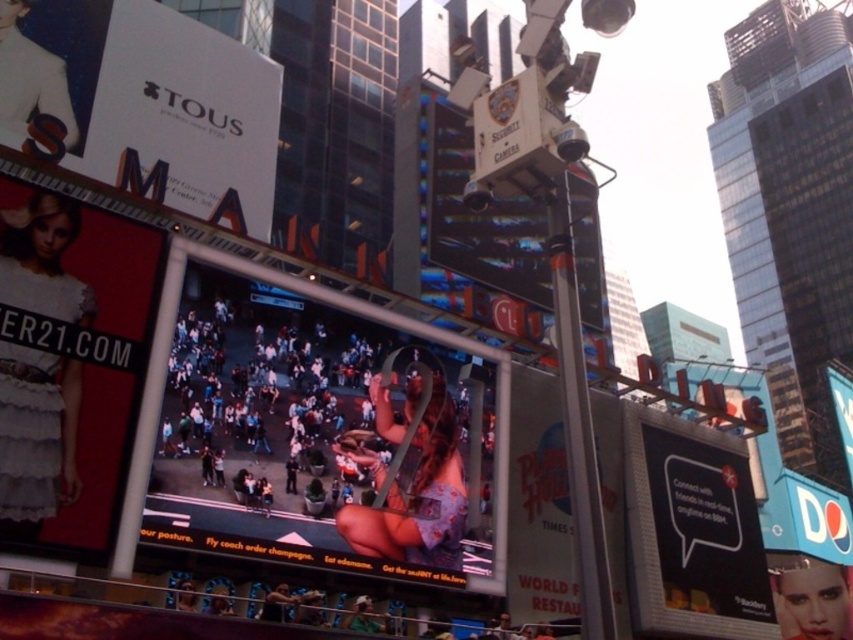
You are standing on a balcony overlooking a city street and see the matte plastic crowd at center and the white glossy signboard at center. Which object is nearer to you?

The matte plastic crowd at center is closer to the viewer than the white glossy signboard at center.

You are standing on a balcony overlooking the city and see two points in the scene. The first point is at coordinate point (161, 509) and the second point is at coordinate point (549, 563). Which point is closer to you?

The point at coordinate point (161, 509) is closer to you because it is in front of point (549, 563).